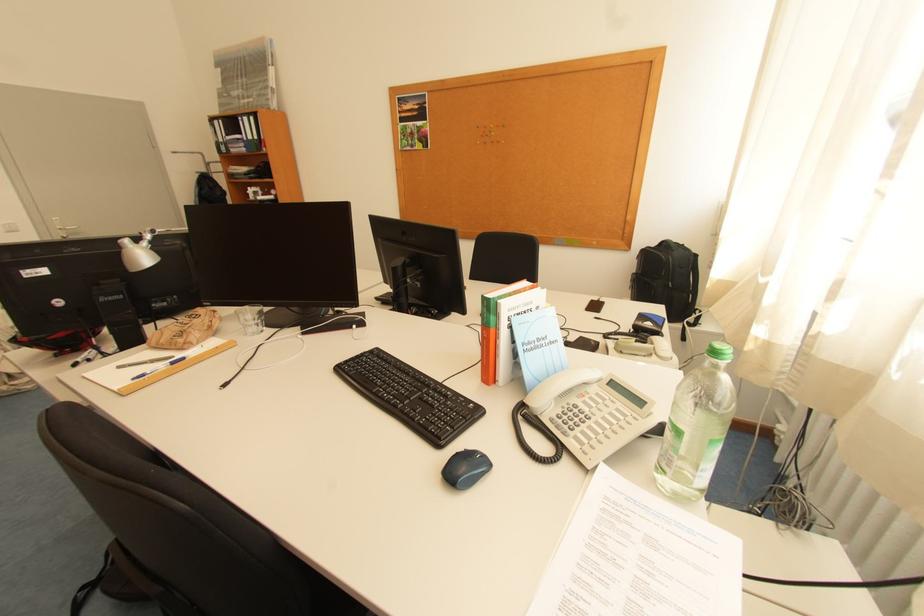
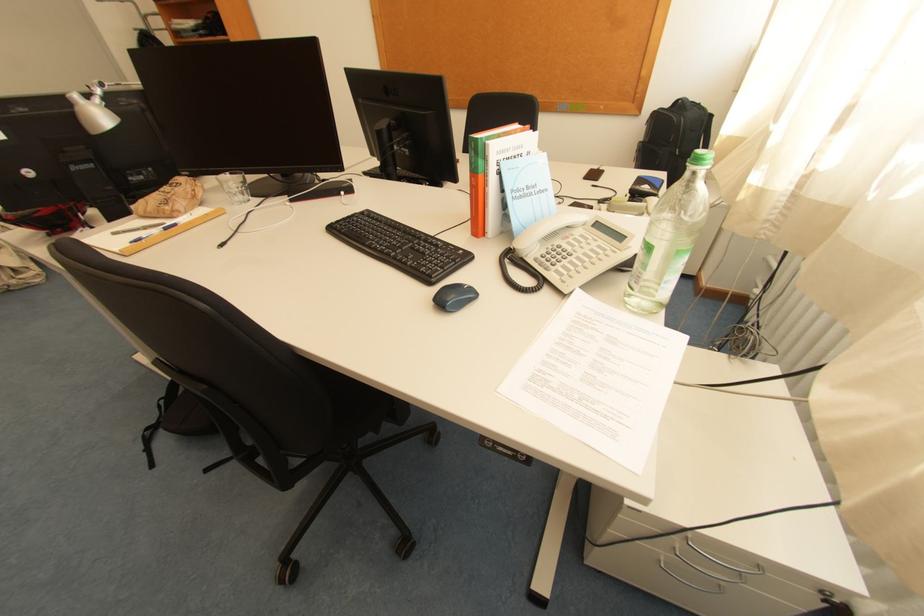
Locate, in the second image, the point that corresponds to point 659,357 in the first image.

(650, 216)